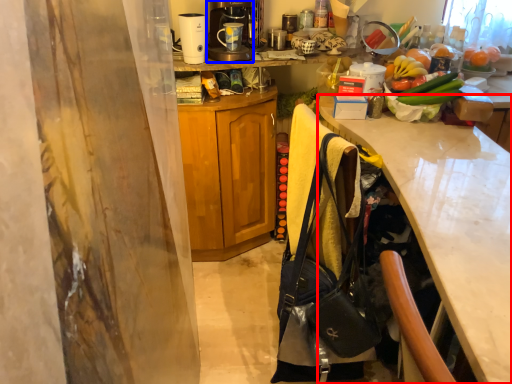
Question: Among these objects, which one is farthest to the camera, desk (highlighted by a red box) or coffee maker (highlighted by a blue box)?

Choices:
 (A) desk
 (B) coffee maker

Answer: (B)